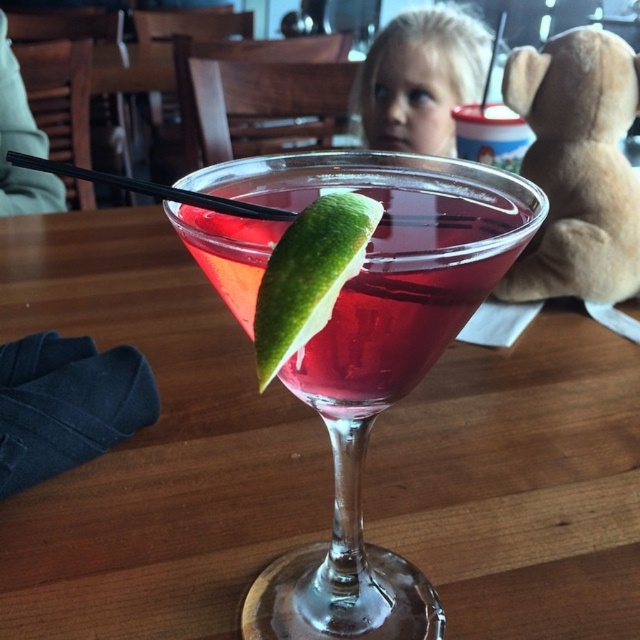
In the scene shown: You are a bartender arranging two points on a cocktail glass. The points are labeled as point (294, 163) and point (308, 305). Which point is closer to the viewer?

Point (294, 163) is closer to the viewer than point (308, 305).

You are a bartender preparing a cocktail. You have two points marked on your glass at coordinates point (362, 380) and point (358, 292). If you want to add a garnish that will be visible to the customer, which point should you place it closer to?

You should place the garnish closer to point (358, 292) because point (362, 380) is behind point (358, 292), making it less visible from the customer perspective.

You are a bartender preparing a drink and see the translucent glass martini at center and the translucent glass drink at center. Which one is closer to you?

The translucent glass martini at center is closer to you since it is only 0.50 inches away from the translucent glass drink at center.